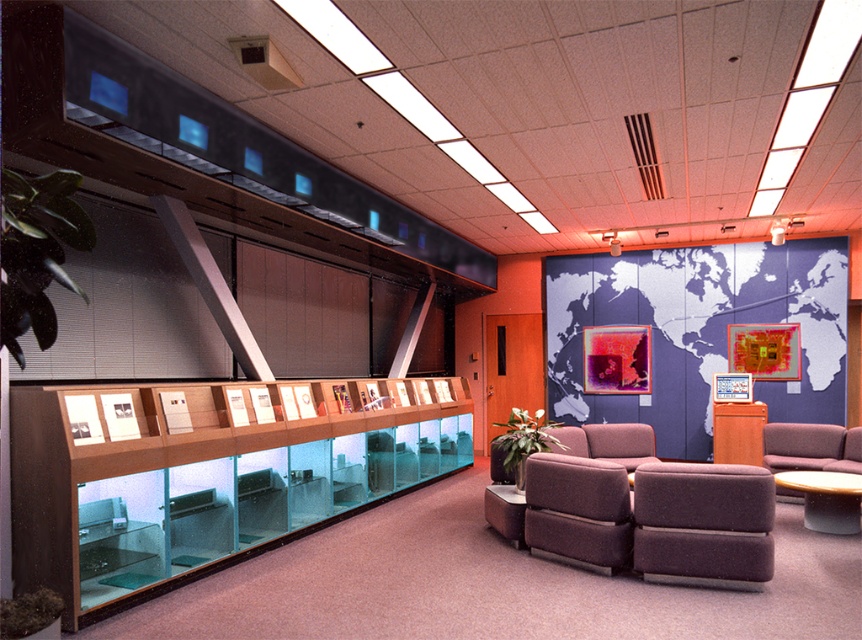
Question: Which point appears farthest from the camera in this image?

Choices:
 (A) (x=615, y=547)
 (B) (x=817, y=444)
 (C) (x=148, y=509)
 (D) (x=738, y=509)

Answer: (B)

Question: Can you confirm if dark brown fabric armchair at lower right is bigger than dark purple fabric couch at center?

Choices:
 (A) yes
 (B) no

Answer: (B)

Question: Among these objects, which one is farthest from the camera?

Choices:
 (A) clear glass display case at left
 (B) brown fabric swivel chair at lower right

Answer: (B)

Question: Can you confirm if brown fabric swivel chair at lower right is thinner than dark brown fabric armchair at lower right?

Choices:
 (A) yes
 (B) no

Answer: (B)

Question: Is clear glass display case at left wider than brown fabric swivel chair at lower right?

Choices:
 (A) yes
 (B) no

Answer: (A)

Question: Which point appears closest to the camera in this image?

Choices:
 (A) (144, 396)
 (B) (594, 506)
 (C) (703, 516)
 (D) (813, 426)

Answer: (C)